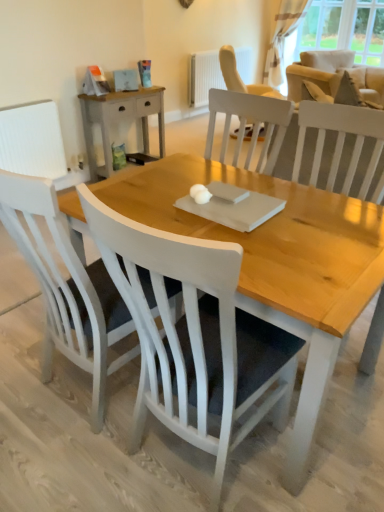
The height and width of the screenshot is (512, 384). I want to click on blank area beneath white wood chair at center, the third chair positioned from the back (from a real-world perspective), so click(x=196, y=466).